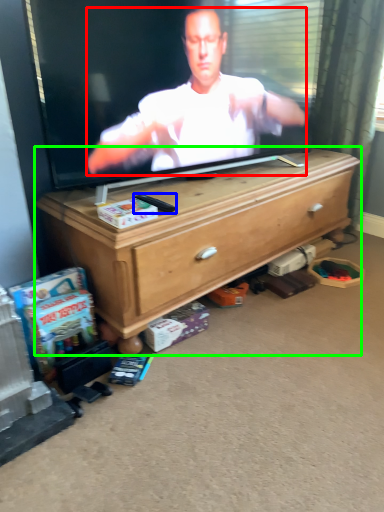
Question: Which is farther away from person (highlighted by a red box)? remote control (highlighted by a blue box) or chest of drawers (highlighted by a green box)?

Choices:
 (A) remote control
 (B) chest of drawers

Answer: (A)